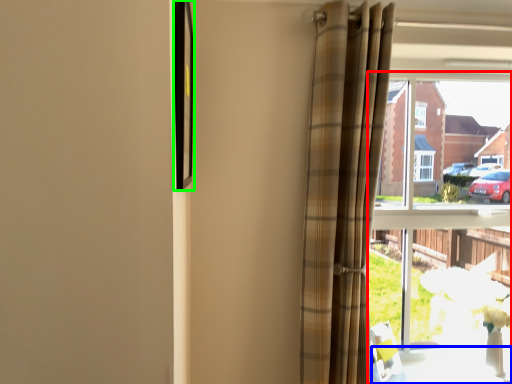
Question: Which object is positioned closest to window (highlighted by a red box)? Select from table (highlighted by a blue box) and picture frame (highlighted by a green box).

Choices:
 (A) table
 (B) picture frame

Answer: (A)